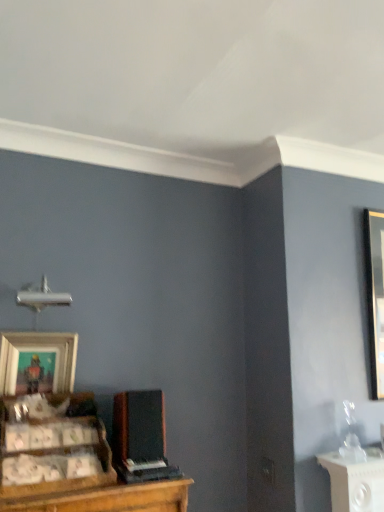
Find the location of a particular element. The width and height of the screenshot is (384, 512). wooden picture frame at lower left is located at coordinates (39, 359).

Based on the photo, measure the distance between wooden picture frame at lower left and camera.

A distance of 5.03 feet exists between wooden picture frame at lower left and camera.

I want to click on wooden cabinet at lower left, so click(x=69, y=461).

How many degrees apart are the facing directions of wooden cabinet at lower left and black matte speaker at center?

4.31 degrees separate the facing orientations of wooden cabinet at lower left and black matte speaker at center.

Between wooden cabinet at lower left and black matte speaker at center, which one has smaller size?

With smaller size is black matte speaker at center.

Is wooden cabinet at lower left to the left or to the right of black matte speaker at center in the image?

Clearly, wooden cabinet at lower left is on the left of black matte speaker at center in the image.

From a real-world perspective, between wooden cabinet at lower left and wooden picture frame at lower left, who is vertically lower?

wooden cabinet at lower left is physically lower.

Is there a large distance between wooden cabinet at lower left and wooden picture frame at lower left?

No, wooden cabinet at lower left is not far from wooden picture frame at lower left.

Can you tell me how much wooden picture frame at lower left and wooden cabinet at lower left differ in facing direction?

There is a 4.31-degree angle between the facing directions of wooden picture frame at lower left and wooden cabinet at lower left.

Identify the location of picture frame on the left of wooden cabinet at lower left. (39, 359).

Which object is further away from the camera, wooden picture frame at lower left or wooden cabinet at lower left?

wooden picture frame at lower left is further from the camera.

From the image's perspective, is wooden picture frame at lower left positioned above or below wooden cabinet at lower left?

Based on their image positions, wooden picture frame at lower left is located above wooden cabinet at lower left.

Which is behind, point (144, 450) or point (64, 383)?

The point (64, 383) is farther from the camera.

Based on the photo, is black matte speaker at center located outside wooden picture frame at lower left?

black matte speaker at center is positioned outside wooden picture frame at lower left.

Visually, is black matte speaker at center positioned to the left or to the right of wooden picture frame at lower left?

Based on their positions, black matte speaker at center is located to the right of wooden picture frame at lower left.

Which of these two, black matte speaker at center or wooden picture frame at lower left, is bigger?

Bigger between the two is black matte speaker at center.

Is wooden picture frame at lower left closer to camera compared to black matte speaker at center?

No, it is not.

Between point (42, 341) and point (137, 455), which one is positioned in front?

The point (137, 455) is closer.

Based on the photo, is wooden picture frame at lower left taller or shorter than black matte speaker at center?

Clearly, wooden picture frame at lower left is taller compared to black matte speaker at center.

Between black matte speaker at center and wooden cabinet at lower left, which one has less height?

black matte speaker at center.

Is black matte speaker at center positioned with its back to wooden cabinet at lower left?

That's not correct — black matte speaker at center is not looking away from wooden cabinet at lower left.

Is black matte speaker at center inside or outside of wooden cabinet at lower left?

black matte speaker at center is not inside wooden cabinet at lower left, it's outside.

Can you confirm if black matte speaker at center is positioned to the right of wooden cabinet at lower left?

Yes.

Find the location of a particular element. speaker below the wooden cabinet at lower left (from the image's perspective) is located at coordinates (138, 426).

Find the location of a particular element. Image resolution: width=384 pixels, height=512 pixels. entertainment center that is on the right side of wooden picture frame at lower left is located at coordinates (69, 461).

From the image, which object appears to be farther from wooden cabinet at lower left, wooden picture frame at lower left or black matte speaker at center?

wooden picture frame at lower left lies further to wooden cabinet at lower left than the other object.

Looking at the image, which one is located closer to black matte speaker at center, wooden picture frame at lower left or wooden cabinet at lower left?

The object closer to black matte speaker at center is wooden cabinet at lower left.

Based on their spatial positions, is wooden cabinet at lower left or black matte speaker at center closer to wooden picture frame at lower left?

Based on the image, wooden cabinet at lower left appears to be nearer to wooden picture frame at lower left.

Based on their spatial positions, is wooden cabinet at lower left or wooden picture frame at lower left further from black matte speaker at center?

wooden picture frame at lower left is positioned further to the anchor black matte speaker at center.

Based on their spatial positions, is black matte speaker at center or wooden picture frame at lower left closer to wooden cabinet at lower left?

black matte speaker at center is positioned closer to the anchor wooden cabinet at lower left.

Looking at the image, which one is located closer to wooden picture frame at lower left, black matte speaker at center or wooden cabinet at lower left?

wooden cabinet at lower left is closer to wooden picture frame at lower left.

Locate an element on the screen. This screenshot has width=384, height=512. entertainment center between wooden picture frame at lower left and black matte speaker at center is located at coordinates (69, 461).